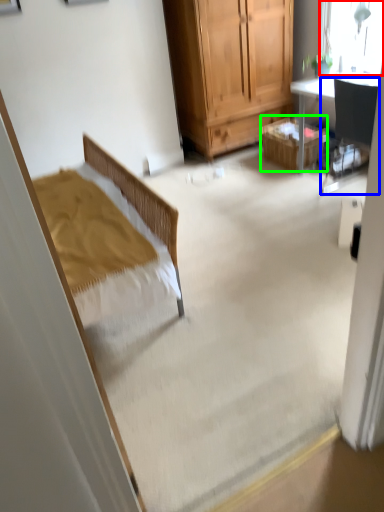
Question: Which is nearer to the window (highlighted by a red box)? chair (highlighted by a blue box) or picnic basket (highlighted by a green box).

Choices:
 (A) chair
 (B) picnic basket

Answer: (A)